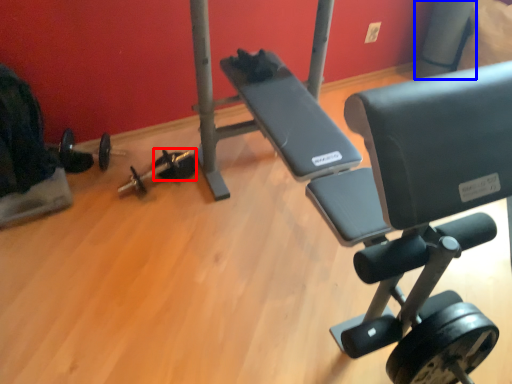
Question: Which point is further to the camera, dumbbell (highlighted by a red box) or pole (highlighted by a blue box)?

Choices:
 (A) dumbbell
 (B) pole

Answer: (B)